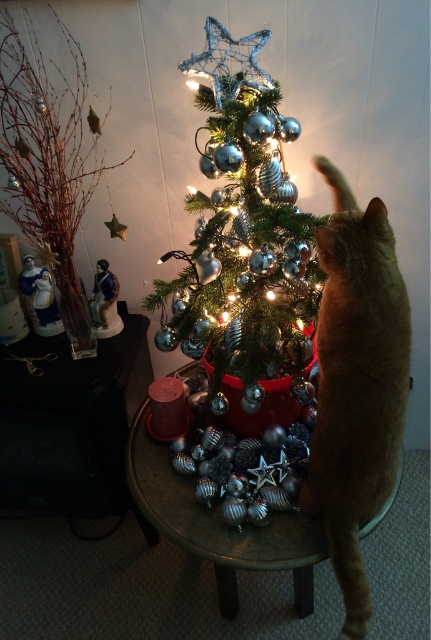
Question: Which is nearer to the orange fur cat at right?

Choices:
 (A) metallic silver table at center
 (B) shiny metallic tree at center

Answer: (B)

Question: Does orange fur cat at right appear over silver metallic ornaments at left?

Choices:
 (A) yes
 (B) no

Answer: (B)

Question: Among these objects, which one is nearest to the camera?

Choices:
 (A) metallic silver table at center
 (B) orange fur cat at right
 (C) shiny metallic tree at center

Answer: (B)

Question: From the image, what is the correct spatial relationship of shiny metallic tree at center in relation to metallic silver table at center?

Choices:
 (A) left
 (B) right

Answer: (B)

Question: Which of the following is the closest to the observer?

Choices:
 (A) silver metallic ornaments at left
 (B) shiny metallic tree at center

Answer: (B)

Question: Observing the image, what is the correct spatial positioning of orange fur cat at right in reference to metallic silver table at center?

Choices:
 (A) above
 (B) below

Answer: (A)